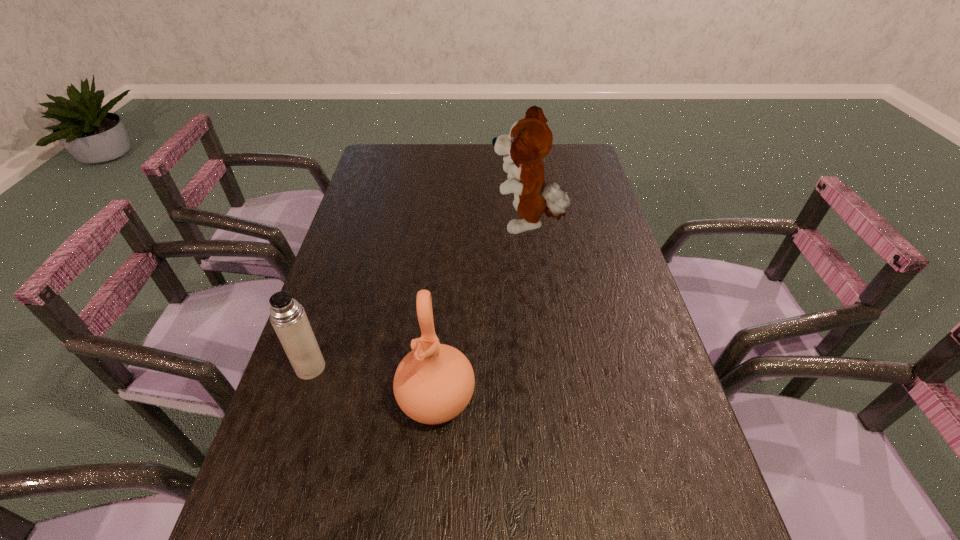
Image resolution: width=960 pixels, height=540 pixels. I want to click on free region located on the right of the shortest object, so click(378, 368).

Image resolution: width=960 pixels, height=540 pixels. In order to click on object situated at the left edge in this screenshot , I will do `click(288, 318)`.

Identify the location of object situated at the right edge. This screenshot has width=960, height=540. (530, 139).

This screenshot has width=960, height=540. Find the location of `vacant position at the far edge of the desktop`. vacant position at the far edge of the desktop is located at coordinates (462, 153).

At what (x,y) coordinates should I click in order to perform the action: click on vacant region at the left edge of the desktop. Please return your answer as a coordinate pair (x, y). The width and height of the screenshot is (960, 540). Looking at the image, I should click on (339, 373).

Locate an element on the screen. blank space at the right edge is located at coordinates pos(663,454).

Where is `free region at the far left corner`? The image size is (960, 540). free region at the far left corner is located at coordinates (382, 151).

Identify the location of free space at the far right corner of the desktop. Image resolution: width=960 pixels, height=540 pixels. (559, 146).

Identify the location of free area in between the leftmost object and the second object from right to left. This screenshot has width=960, height=540. 373,384.

The image size is (960, 540). In order to click on vacant point located between the tallest object and the second object from right to left in this screenshot , I will do `click(482, 313)`.